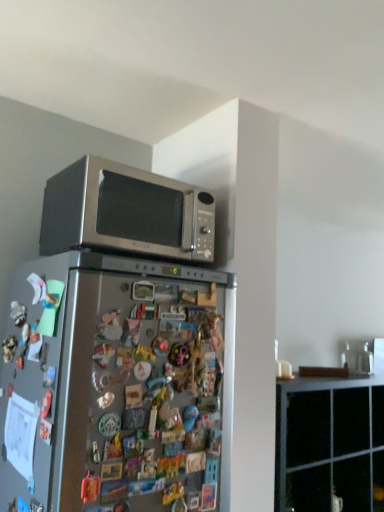
Question: Does satin silver microwave at upper center have a lesser height compared to black matte cabinet at upper right?

Choices:
 (A) no
 (B) yes

Answer: (B)

Question: From the image's perspective, is satin silver microwave at upper center below black matte cabinet at upper right?

Choices:
 (A) yes
 (B) no

Answer: (B)

Question: Is satin silver microwave at upper center outside of black matte cabinet at upper right?

Choices:
 (A) no
 (B) yes

Answer: (B)

Question: Considering the relative sizes of satin silver microwave at upper center and black matte cabinet at upper right in the image provided, is satin silver microwave at upper center taller than black matte cabinet at upper right?

Choices:
 (A) no
 (B) yes

Answer: (A)

Question: Considering the relative sizes of satin silver microwave at upper center and black matte cabinet at upper right in the image provided, is satin silver microwave at upper center bigger than black matte cabinet at upper right?

Choices:
 (A) yes
 (B) no

Answer: (B)

Question: Does satin silver microwave at upper center have a lesser width compared to black matte cabinet at upper right?

Choices:
 (A) no
 (B) yes

Answer: (A)

Question: Is satin silver refrigerator at center facing away from black matte cabinet at upper right?

Choices:
 (A) no
 (B) yes

Answer: (A)

Question: Does satin silver refrigerator at center have a smaller size compared to black matte cabinet at upper right?

Choices:
 (A) no
 (B) yes

Answer: (A)

Question: Does satin silver refrigerator at center have a greater width compared to black matte cabinet at upper right?

Choices:
 (A) no
 (B) yes

Answer: (B)

Question: Considering the relative positions of satin silver refrigerator at center and black matte cabinet at upper right in the image provided, is satin silver refrigerator at center to the left of black matte cabinet at upper right from the viewer's perspective?

Choices:
 (A) no
 (B) yes

Answer: (B)

Question: Is satin silver refrigerator at center beside black matte cabinet at upper right?

Choices:
 (A) yes
 (B) no

Answer: (B)

Question: Is satin silver refrigerator at center in front of black matte cabinet at upper right?

Choices:
 (A) no
 (B) yes

Answer: (B)

Question: Can you confirm if black matte cabinet at upper right is smaller than satin silver microwave at upper center?

Choices:
 (A) no
 (B) yes

Answer: (A)